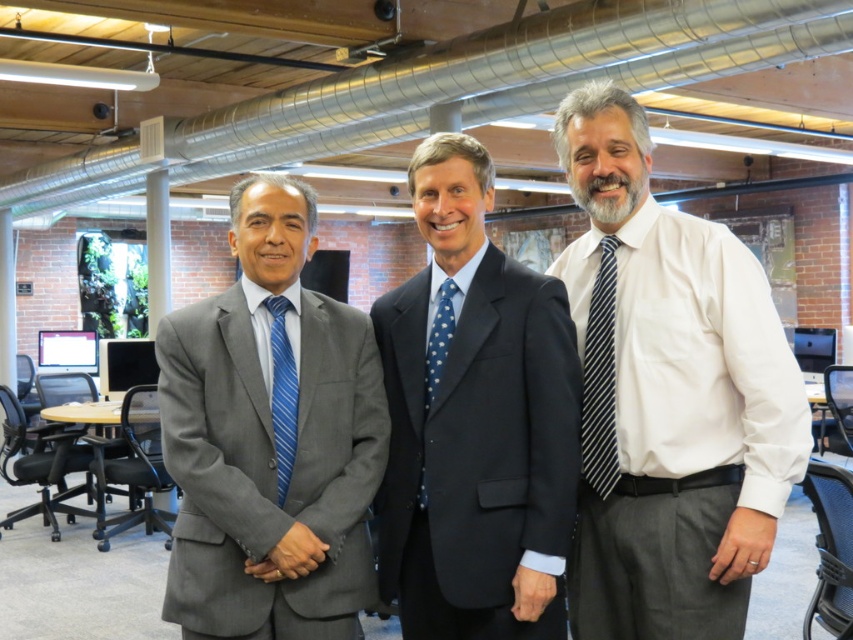
In the office scene with exposed brick walls and industrial ductwork, there are two men wearing formal attire. The first man is wearing a gray suit at center, and the second is wearing a blue dotted fabric tie at center. From the perspective of someone facing the scene, which clothing item is positioned to the left?

The gray suit at center is positioned to the left of the blue dotted fabric tie at center.